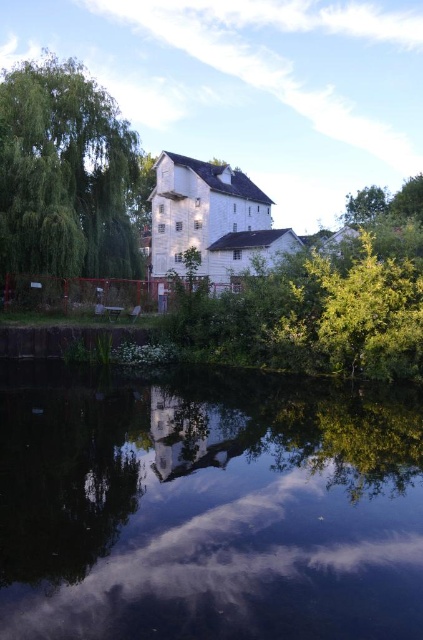
You are standing at the riverside and want to take a photo of the transparent glass lake at center and the green leafy tree at left. Which object should you focus on first if you want to capture both in a single shot without moving your camera?

You should focus on the transparent glass lake at center first because it is closer to you than the green leafy tree at left, allowing both to be in the frame without moving the camera.

You are an artist planning to paint the riverside scene. You want to ensure the transparent glass lake at center and the green leafy tree at upper right are proportionally accurate. Which object should you paint first to maintain the correct size relationship between them?

You should paint the green leafy tree at upper right first because the transparent glass lake at center is smaller in size compared to it, allowing you to establish the larger object first and then adjust the smaller one accordingly.